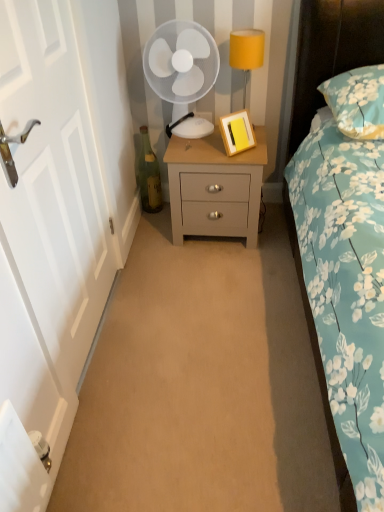
Question: Considering the relative sizes of yellow matte picture frame at center and white plastic fan at upper center in the image provided, is yellow matte picture frame at center bigger than white plastic fan at upper center?

Choices:
 (A) no
 (B) yes

Answer: (A)

Question: From a real-world perspective, is yellow matte picture frame at center on top of white plastic fan at upper center?

Choices:
 (A) yes
 (B) no

Answer: (B)

Question: Considering the relative sizes of yellow matte picture frame at center and white plastic fan at upper center in the image provided, is yellow matte picture frame at center smaller than white plastic fan at upper center?

Choices:
 (A) yes
 (B) no

Answer: (A)

Question: Can you confirm if yellow matte picture frame at center is thinner than white plastic fan at upper center?

Choices:
 (A) no
 (B) yes

Answer: (B)

Question: From a real-world perspective, is yellow matte picture frame at center physically below white plastic fan at upper center?

Choices:
 (A) no
 (B) yes

Answer: (B)

Question: Is yellow matte picture frame at center turned away from white plastic fan at upper center?

Choices:
 (A) yes
 (B) no

Answer: (A)

Question: Can you confirm if white plastic fan at upper center is taller than light gray wood nightstand at center?

Choices:
 (A) yes
 (B) no

Answer: (A)

Question: Is white plastic fan at upper center positioned before light gray wood nightstand at center?

Choices:
 (A) yes
 (B) no

Answer: (A)

Question: Is white plastic fan at upper center positioned far away from light gray wood nightstand at center?

Choices:
 (A) yes
 (B) no

Answer: (B)

Question: Considering the relative sizes of white plastic fan at upper center and light gray wood nightstand at center in the image provided, is white plastic fan at upper center wider than light gray wood nightstand at center?

Choices:
 (A) yes
 (B) no

Answer: (B)

Question: Is white plastic fan at upper center further to the viewer compared to light gray wood nightstand at center?

Choices:
 (A) yes
 (B) no

Answer: (B)

Question: Is white plastic fan at upper center smaller than light gray wood nightstand at center?

Choices:
 (A) yes
 (B) no

Answer: (A)

Question: Could you tell me if light gray wood nightstand at center is facing white plastic fan at upper center?

Choices:
 (A) no
 (B) yes

Answer: (A)